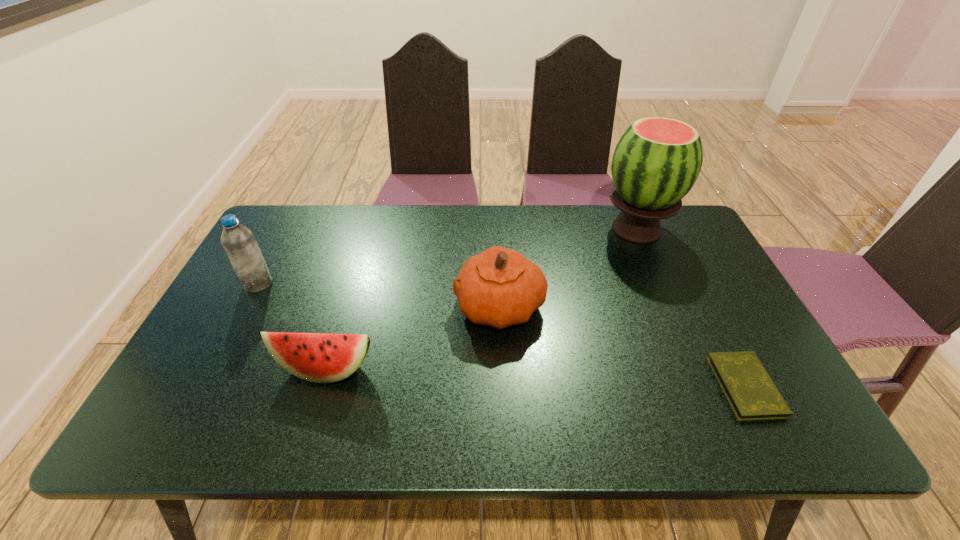
Identify the location of diary present at the right edge. (750, 391).

At what (x,y) coordinates should I click in order to perform the action: click on object present at the far right corner. Please return your answer as a coordinate pair (x, y). This screenshot has width=960, height=540. Looking at the image, I should click on click(656, 162).

Locate an element on the screen. This screenshot has height=540, width=960. object at the near right corner is located at coordinates (750, 391).

The image size is (960, 540). Identify the location of vacant space at the far edge of the desktop. (425, 205).

The height and width of the screenshot is (540, 960). I want to click on vacant space at the near edge of the desktop, so click(x=556, y=427).

You are a GUI agent. You are given a task and a screenshot of the screen. Output one action in this format:
    pyautogui.click(x=<x>, y=<y>)
    Task: Click on the vacant space at the left edge of the desktop
    This screenshot has height=540, width=960.
    Given the screenshot: What is the action you would take?
    pyautogui.click(x=201, y=345)

In the image, there is a desktop. Find the location of `vacant space at the right edge`. vacant space at the right edge is located at coordinates (698, 302).

Identify the location of free space at the near left corner of the desktop. Image resolution: width=960 pixels, height=540 pixels. [x=192, y=406].

The height and width of the screenshot is (540, 960). In the image, there is a desktop. What are the coordinates of `vacant region at the near right corner` in the screenshot? It's located at (752, 428).

At what (x,y) coordinates should I click in order to perform the action: click on vacant area that lies between the farthest object and the pumpkin. Please return your answer as a coordinate pair (x, y). The width and height of the screenshot is (960, 540). Looking at the image, I should click on (568, 268).